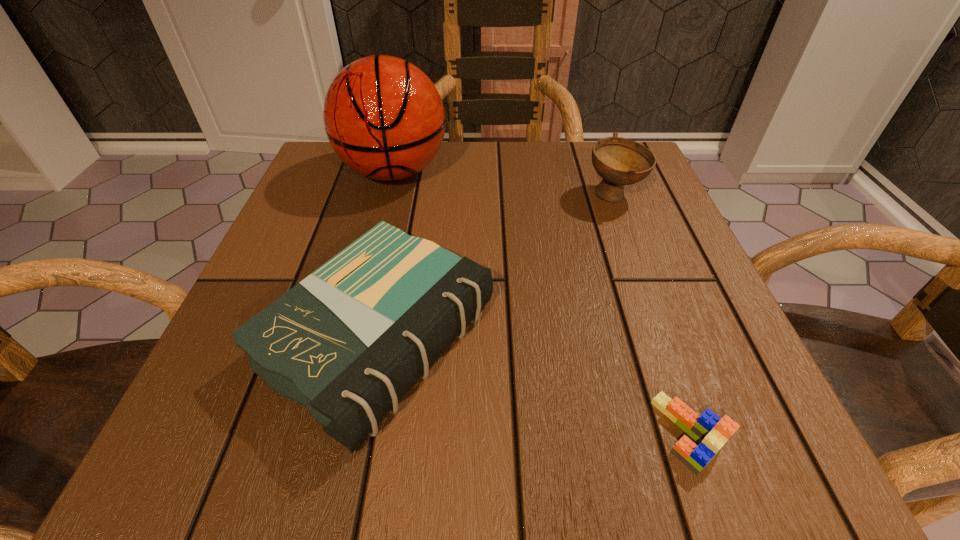
The width and height of the screenshot is (960, 540). Find the location of `the tallest object`. the tallest object is located at coordinates (383, 116).

At what (x,y) coordinates should I click in order to perform the action: click on the third shortest object. Please return your answer as a coordinate pair (x, y). Looking at the image, I should click on (619, 161).

What are the coordinates of `paperback book` in the screenshot? It's located at (348, 342).

Where is `Lego`? Lego is located at coordinates (711, 432).

Image resolution: width=960 pixels, height=540 pixels. In order to click on free spot located 0.080m on the side with spill of the basketball in this screenshot , I will do `click(379, 230)`.

Identify the location of vacant space situated 0.310m on the front of the soup bowl. The image size is (960, 540). (670, 345).

Identify the location of free space located 0.220m on the back of the paperback book. (410, 185).

Locate an element on the screen. The height and width of the screenshot is (540, 960). free space located 0.120m on the left of the shortest object is located at coordinates (563, 433).

Image resolution: width=960 pixels, height=540 pixels. I want to click on basketball that is at the far edge, so click(383, 116).

Where is `soup bowl located at the far edge`? The image size is (960, 540). soup bowl located at the far edge is located at coordinates (619, 161).